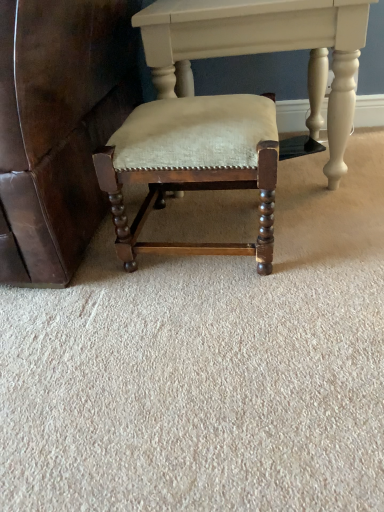
I want to click on vacant space in matte wood chair at center (from a real-world perspective), so click(206, 232).